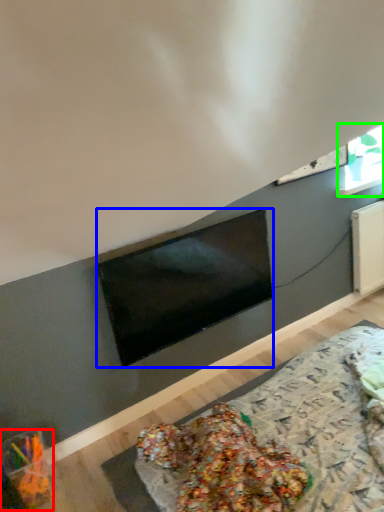
Question: Which object is the farthest from food (highlighted by a red box)? Choose among these: television (highlighted by a blue box) or window (highlighted by a green box).

Choices:
 (A) television
 (B) window

Answer: (B)